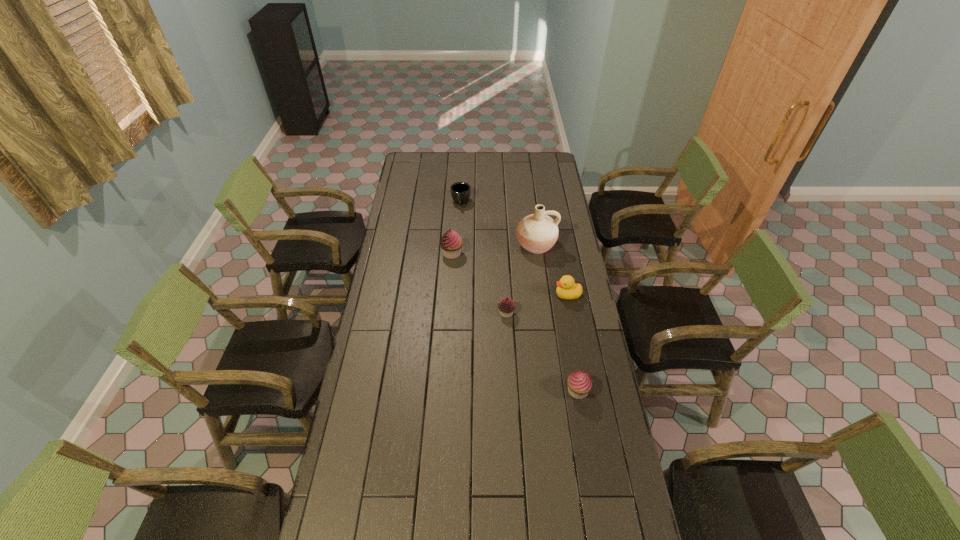
Locate an element on the screen. the tallest cupcake is located at coordinates (451, 242).

Identify the location of the leftmost cupcake. (451, 242).

Where is `the second cupcake from left to right`? The width and height of the screenshot is (960, 540). the second cupcake from left to right is located at coordinates (506, 306).

At what (x,y) coordinates should I click in order to perform the action: click on the fourth object from right to left. Please return your answer as a coordinate pair (x, y). This screenshot has width=960, height=540. Looking at the image, I should click on (506, 306).

Find the location of `the rightmost cupcake`. the rightmost cupcake is located at coordinates (580, 383).

Where is `the nearest cupcake`? The image size is (960, 540). the nearest cupcake is located at coordinates (580, 383).

Image resolution: width=960 pixels, height=540 pixels. Find the location of `the farthest object`. the farthest object is located at coordinates (460, 191).

What are the coordinates of `pottery` in the screenshot? It's located at (537, 233).

The width and height of the screenshot is (960, 540). In order to click on duck in this screenshot , I will do `click(567, 289)`.

Where is `free space located 0.090m on the back of the fifth shortest object`? Image resolution: width=960 pixels, height=540 pixels. free space located 0.090m on the back of the fifth shortest object is located at coordinates (453, 234).